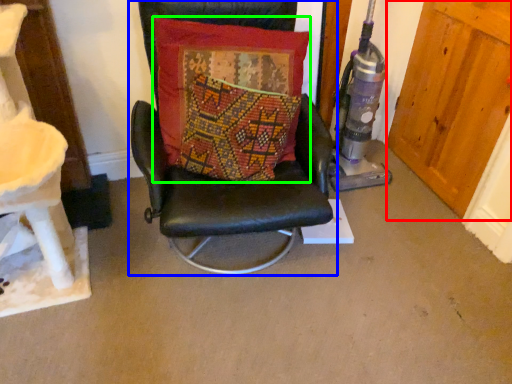
Question: Which object is positioned farthest from door (highlighted by a red box)? Select from chair (highlighted by a blue box) and pillow (highlighted by a green box).

Choices:
 (A) chair
 (B) pillow

Answer: (B)